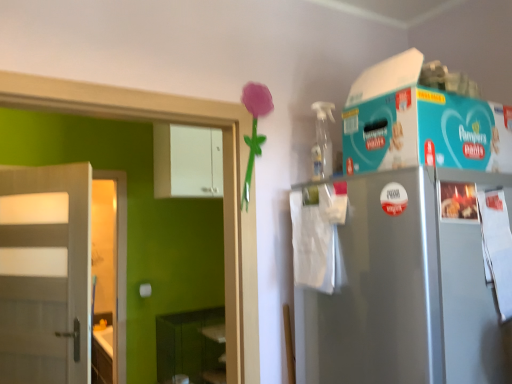
Question: Does white matte door at left have a greater width compared to white glossy cabinet at upper center?

Choices:
 (A) yes
 (B) no

Answer: (B)

Question: Is white matte door at left looking in the opposite direction of white glossy cabinet at upper center?

Choices:
 (A) no
 (B) yes

Answer: (B)

Question: Could you tell me if white matte door at left is facing white glossy cabinet at upper center?

Choices:
 (A) yes
 (B) no

Answer: (B)

Question: From the image's perspective, does white matte door at left appear lower than white glossy cabinet at upper center?

Choices:
 (A) no
 (B) yes

Answer: (B)

Question: Can you confirm if white matte door at left is bigger than white glossy cabinet at upper center?

Choices:
 (A) no
 (B) yes

Answer: (A)

Question: Is white matte door at left closer to camera compared to white glossy cabinet at upper center?

Choices:
 (A) no
 (B) yes

Answer: (B)

Question: Does green matte shelf at lower left touch white glossy cabinet at upper center?

Choices:
 (A) no
 (B) yes

Answer: (A)

Question: From a real-world perspective, does green matte shelf at lower left sit lower than white glossy cabinet at upper center?

Choices:
 (A) no
 (B) yes

Answer: (B)

Question: Could white glossy cabinet at upper center be considered to be inside green matte shelf at lower left?

Choices:
 (A) no
 (B) yes

Answer: (A)

Question: Are green matte shelf at lower left and white glossy cabinet at upper center far apart?

Choices:
 (A) yes
 (B) no

Answer: (A)

Question: Does green matte shelf at lower left have a larger size compared to white glossy cabinet at upper center?

Choices:
 (A) yes
 (B) no

Answer: (A)

Question: Is green matte shelf at lower left to the left of white glossy cabinet at upper center from the viewer's perspective?

Choices:
 (A) yes
 (B) no

Answer: (B)

Question: Could you tell me if green matte shelf at lower left is turned towards white matte door at left?

Choices:
 (A) no
 (B) yes

Answer: (A)